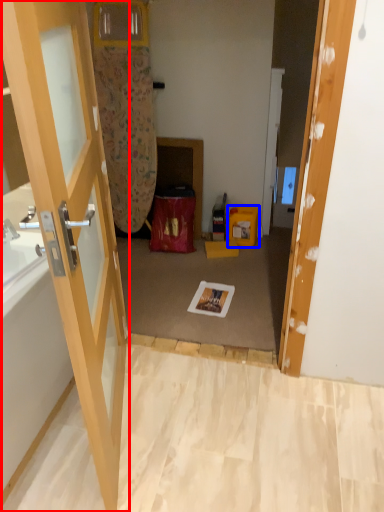
Question: Among these objects, which one is nearest to the camera, door (highlighted by a red box) or box (highlighted by a blue box)?

Choices:
 (A) door
 (B) box

Answer: (A)